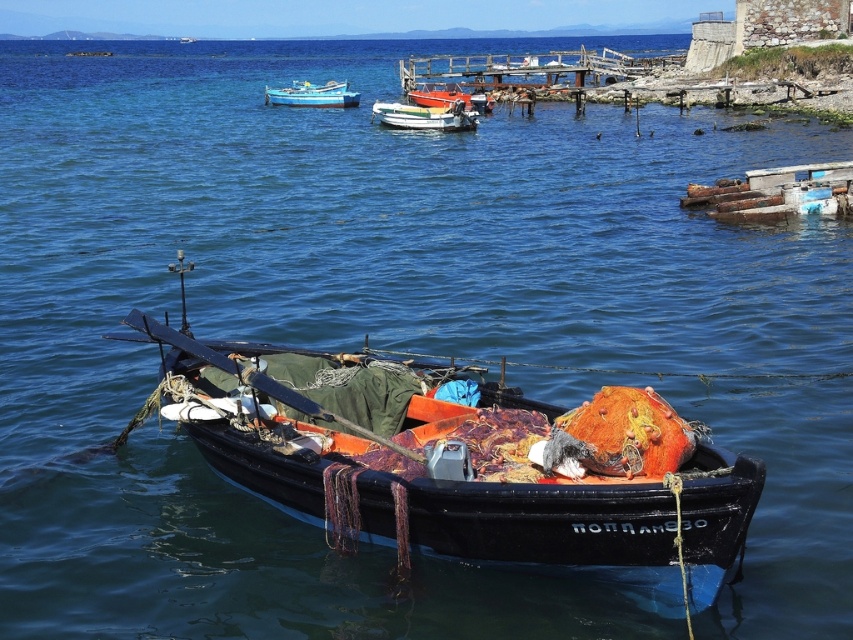
You are standing on the wooden pier and see both the black wooden boat at center and the blue painted wooden boat at upper center. Which boat is positioned more to the right side of the scene?

The black wooden boat at center is positioned more to the right side of the scene compared to the blue painted wooden boat at upper center.

You are standing on the rocky shoreline next to the fishing boat. There is a point in the water marked at coordinate (651, 572). If you want to reach that point without getting wet, can you walk directly to it from your current position?

The point at coordinate (651, 572) is 23.73 feet away from the viewer. Since you are on the rocky shoreline next to the fishing boat, you would need to walk 23.73 feet to reach it. However, the distance alone doesn t indicate whether the path is dry. The scene shows water surrounding the boat and a wooden pier extending into the sea, but there is no mention of a path or land extending to that specific point. Therefore, it s likely you would get wet trying to reach it directly.

You are a sailor who needs to board the black wooden boat at center and the white glossy boat at center. Which boat should you approach first if you want to reach the one on the left side first?

You should approach the white glossy boat at center first because the black wooden boat at center is to the right of it, so the white glossy boat at center is on the left side.